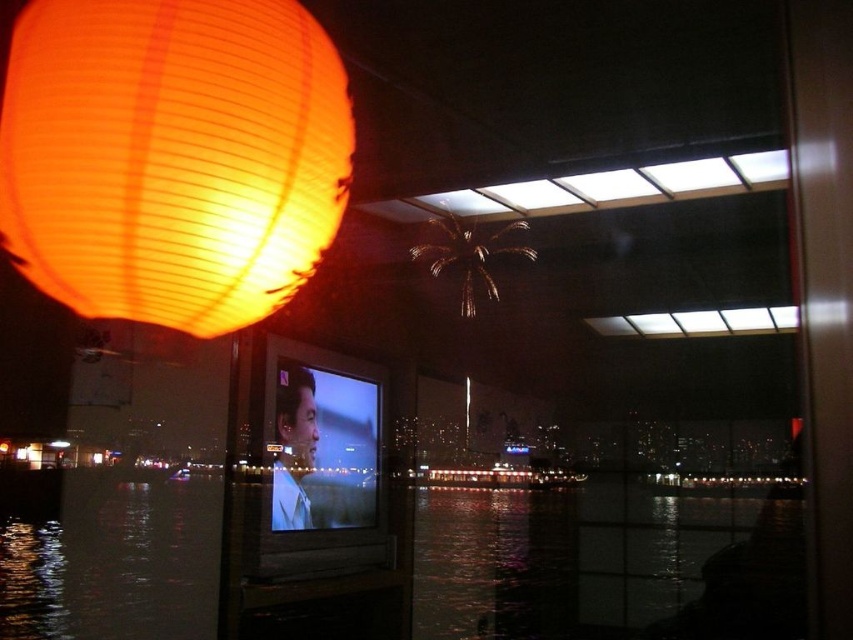
You are navigating a boat at night and need to determine the position of the matte paper lantern at upper left relative to the city skyline in the background. Based on the coordinates provided, is the lantern positioned to the left or right of the city skyline?

The matte paper lantern at upper left is located at point 0.244 on the x and 0.203 on the y, which places it to the left side of the city skyline in the background.

In the scene shown: You are standing inside the boat and see the point marked at coordinate (392, 563). Where is this point located in relation to the transparent glass water at center?

The point marked at coordinate (392, 563) is located on the transparent glass water at center.